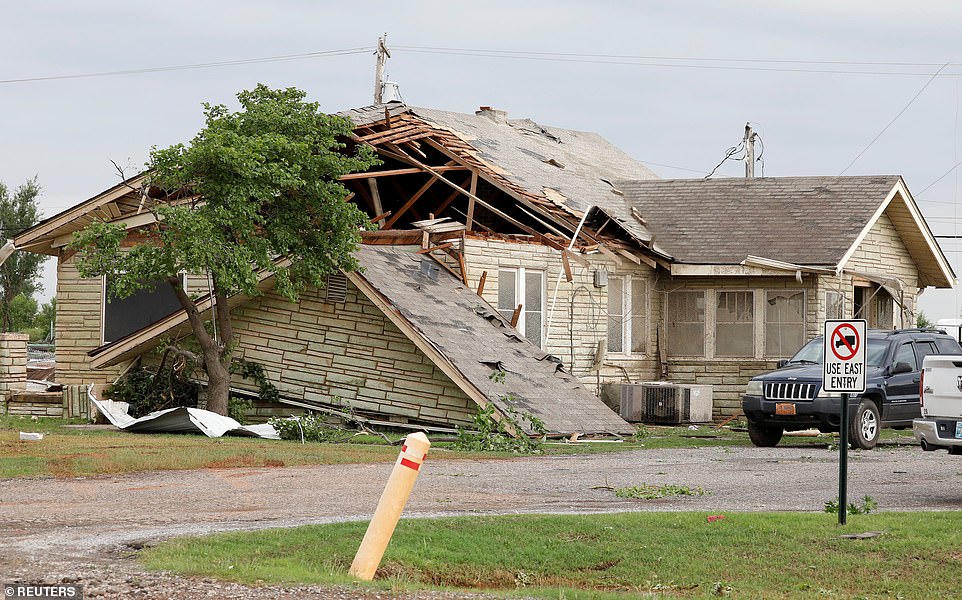
Image resolution: width=962 pixels, height=600 pixels. What are the coordinates of `windows` in the screenshot? It's located at (776, 326), (743, 326), (688, 327), (644, 328), (604, 328), (542, 296), (508, 299), (135, 305).